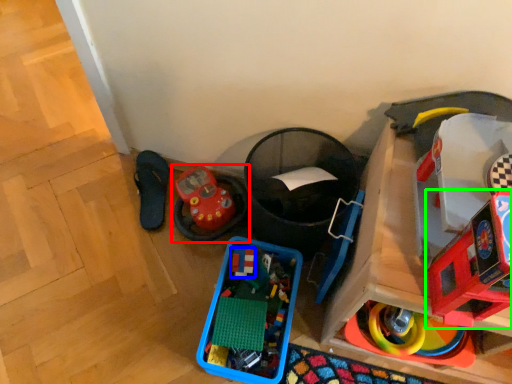
Question: Based on their relative distances, which object is nearer to toy (highlighted by a red box)? Choose from toy (highlighted by a blue box) and toy (highlighted by a green box).

Choices:
 (A) toy
 (B) toy

Answer: (A)